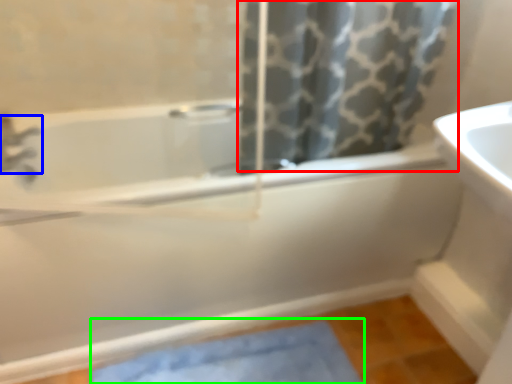
Question: Which is farther away from shower curtain (highlighted by a red box)? tap (highlighted by a blue box) or bath mat (highlighted by a green box)?

Choices:
 (A) tap
 (B) bath mat

Answer: (A)